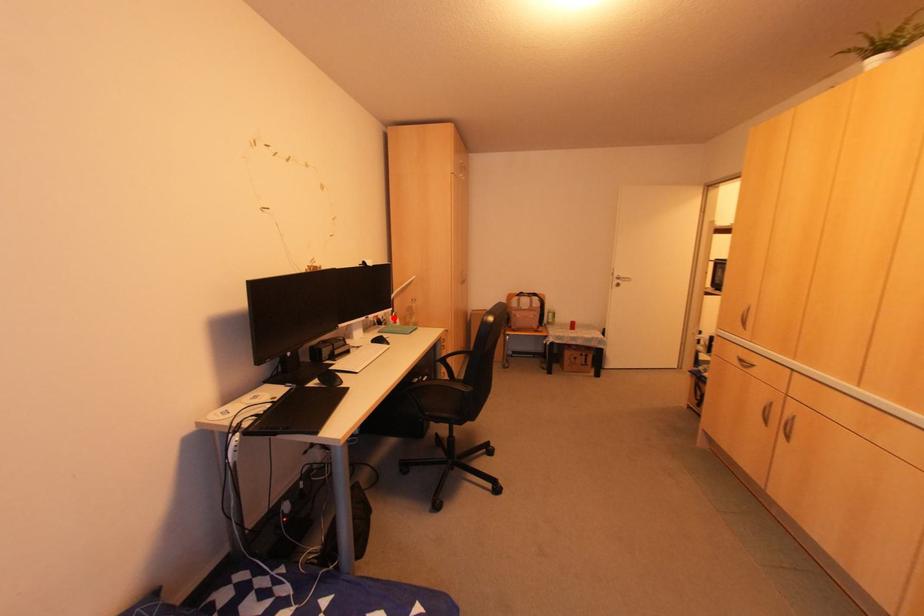
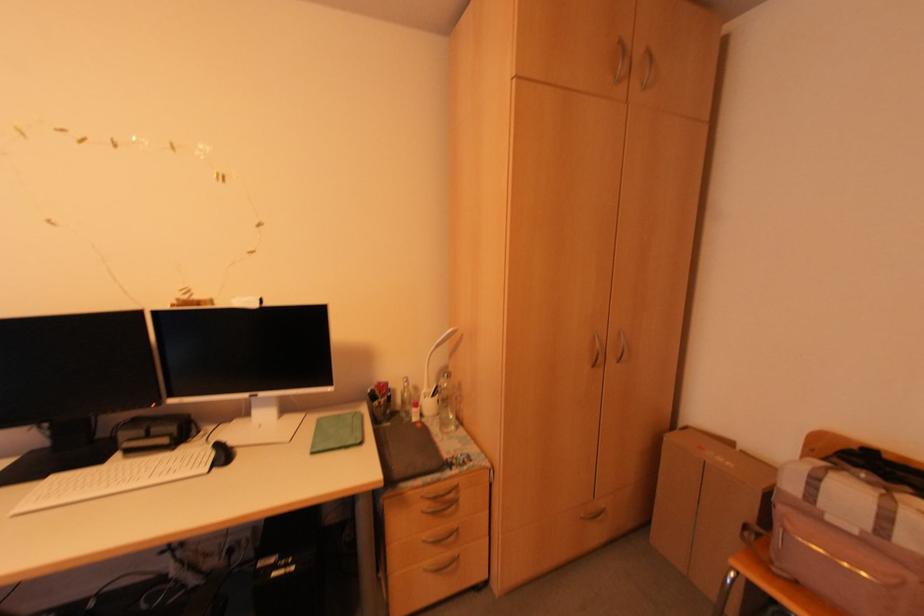
In the second image, find the point that corresponds to the highlighted location in the first image.

(431, 395)